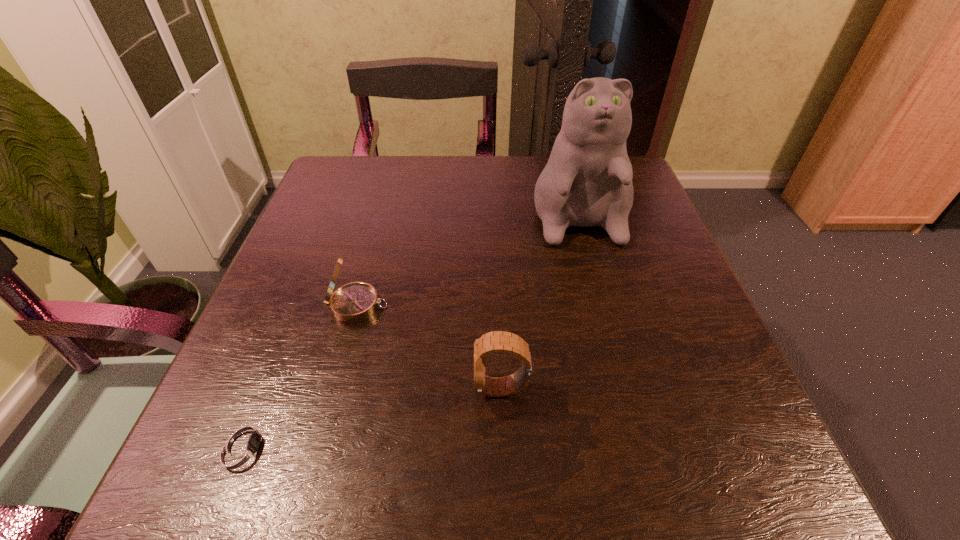
Where is `the tallest object`? the tallest object is located at coordinates (587, 181).

In order to click on the rightmost object in this screenshot , I will do `click(587, 181)`.

Find the location of `the third farthest object`. the third farthest object is located at coordinates (498, 341).

Where is `the third object from left to right`? This screenshot has width=960, height=540. the third object from left to right is located at coordinates (498, 341).

The width and height of the screenshot is (960, 540). Identify the location of the third object from right to left. (355, 302).

Find the location of a particular element. Image resolution: width=960 pixels, height=540 pixels. the second farthest object is located at coordinates 355,302.

Where is `the left watch`? Image resolution: width=960 pixels, height=540 pixels. the left watch is located at coordinates (242, 448).

Image resolution: width=960 pixels, height=540 pixels. Identify the location of the nearest object. (242, 448).

Locate an element on the screen. free region located 0.260m on the face of the tallest object is located at coordinates (616, 353).

Where is `vacant space located on the face of the third farthest object`? vacant space located on the face of the third farthest object is located at coordinates tap(355, 388).